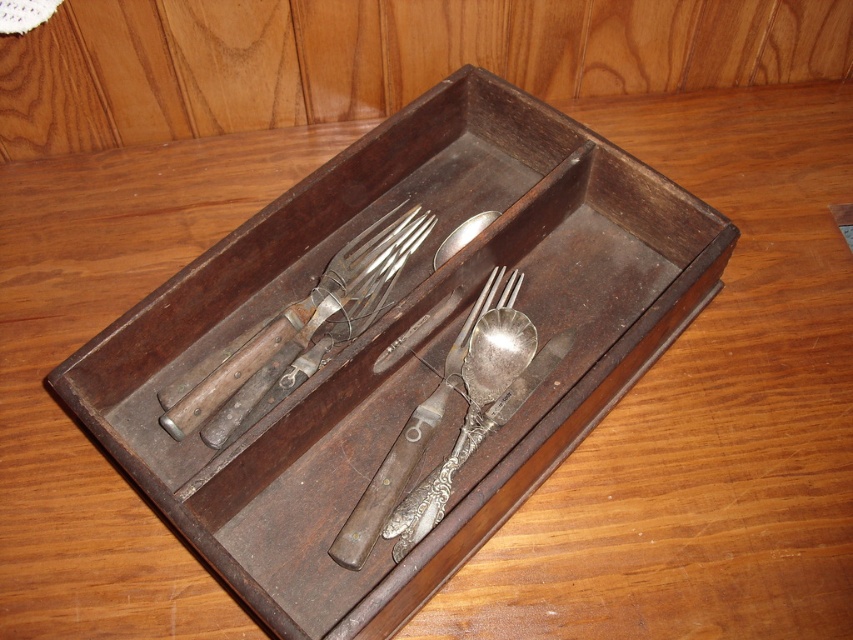
Is wooden tray at center to the right of wooden-handled fork at center from the viewer's perspective?

Indeed, wooden tray at center is positioned on the right side of wooden-handled fork at center.

Does wooden tray at center have a smaller size compared to wooden-handled fork at center?

No, wooden tray at center is not smaller than wooden-handled fork at center.

Between point (200, 444) and point (392, 211), which one is positioned behind?

Point (392, 211)

Image resolution: width=853 pixels, height=640 pixels. I want to click on wooden tray at center, so click(x=396, y=346).

Is the position of wooden-handled fork at center more distant than that of silver polished spoon at center?

That is True.

Who is lower down, wooden-handled fork at center or silver polished spoon at center?

silver polished spoon at center

Is point (277, 360) positioned behind point (434, 422)?

Yes, it is behind point (434, 422).

Where is `wooden-handled fork at center`? wooden-handled fork at center is located at coordinates (300, 326).

Consider the image. Who is more distant from viewer, (338, 272) or (491, 211)?

The point (491, 211) is behind.

Is wooden-handled fork at center to the right of polished silver spoon at center from the viewer's perspective?

No, wooden-handled fork at center is not to the right of polished silver spoon at center.

Is point (293, 349) positioned after point (467, 236)?

No.

Locate an element on the screen. wooden-handled fork at center is located at coordinates (300, 326).